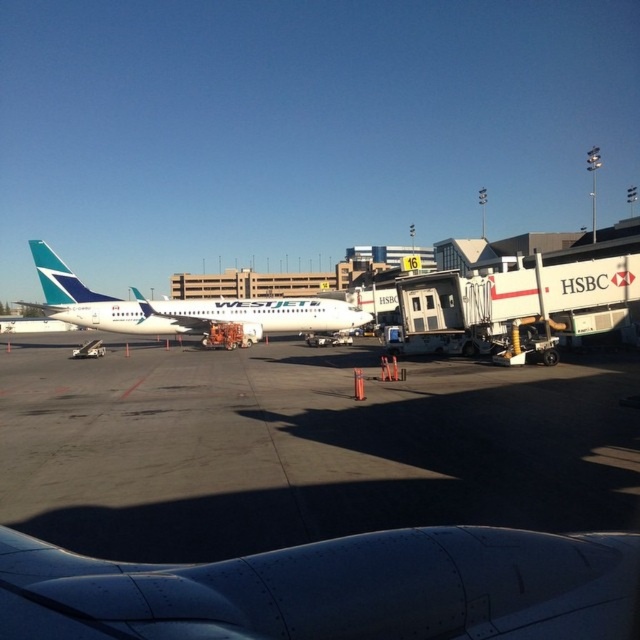
Question: From the image, what is the correct spatial relationship of metallic gray engine at lower center in relation to white glossy airplane at center?

Choices:
 (A) right
 (B) left

Answer: (A)

Question: Is metallic gray engine at lower center below white glossy airplane at center?

Choices:
 (A) no
 (B) yes

Answer: (B)

Question: Which point is farther from the camera taking this photo?

Choices:
 (A) (68, 611)
 (B) (112, 324)

Answer: (B)

Question: Which point appears closest to the camera in this image?

Choices:
 (A) (308, 557)
 (B) (33, 256)

Answer: (A)

Question: Which point is farther from the camera taking this photo?

Choices:
 (A) (12, 627)
 (B) (243, 304)

Answer: (B)

Question: Does metallic gray engine at lower center have a larger size compared to white glossy airplane at center?

Choices:
 (A) yes
 (B) no

Answer: (B)